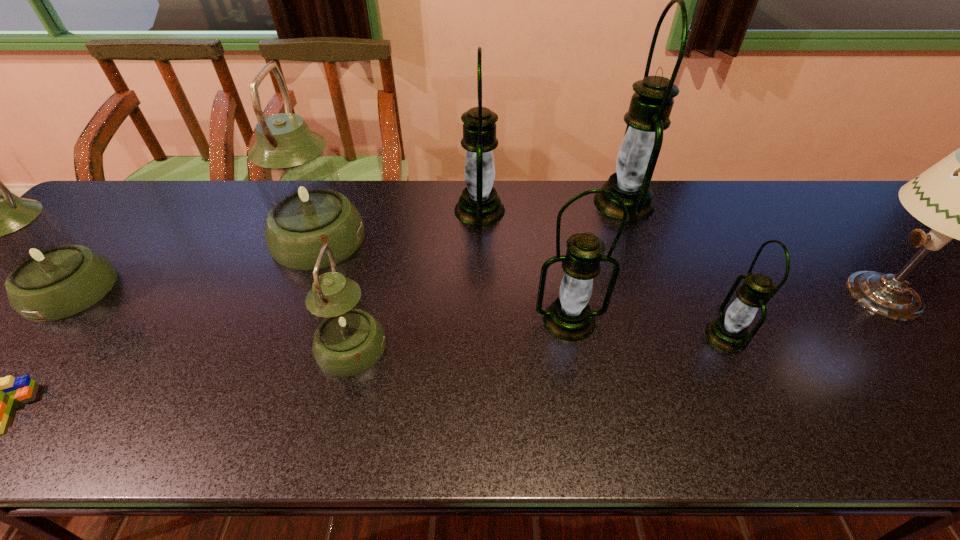
Where is `free spot located 0.330m on the side where the tallest lantern emits light`? This screenshot has height=540, width=960. free spot located 0.330m on the side where the tallest lantern emits light is located at coordinates (484, 203).

Where is `vacant space located on the side where the tallest lantern emits light`? This screenshot has height=540, width=960. vacant space located on the side where the tallest lantern emits light is located at coordinates (537, 203).

Identify the location of vacant area situated 0.400m on the side where the tallest lantern emits light. This screenshot has width=960, height=540. (460, 203).

The height and width of the screenshot is (540, 960). In order to click on free space located 0.270m on the side where the fifth object from right to left emits light in this screenshot , I will do `click(597, 210)`.

Identify the location of vacant space located 0.200m on the front of the biggest greenish lantern. Image resolution: width=960 pixels, height=540 pixels. (280, 334).

Where is `free space located on the lampshade of the lampshade`? Image resolution: width=960 pixels, height=540 pixels. free space located on the lampshade of the lampshade is located at coordinates (777, 294).

This screenshot has height=540, width=960. Find the location of `vacant space located 0.070m on the lampshade of the lampshade`. vacant space located 0.070m on the lampshade of the lampshade is located at coordinates (809, 294).

In order to click on free space located 0.200m on the lampshade of the lampshade in this screenshot , I will do `click(756, 294)`.

The image size is (960, 540). Find the location of `vacant region located on the side where the third lantern from right to left emits light`. vacant region located on the side where the third lantern from right to left emits light is located at coordinates (583, 395).

The width and height of the screenshot is (960, 540). I want to click on vacant space located 0.140m on the side where the smallest green lantern emits light, so click(x=643, y=336).